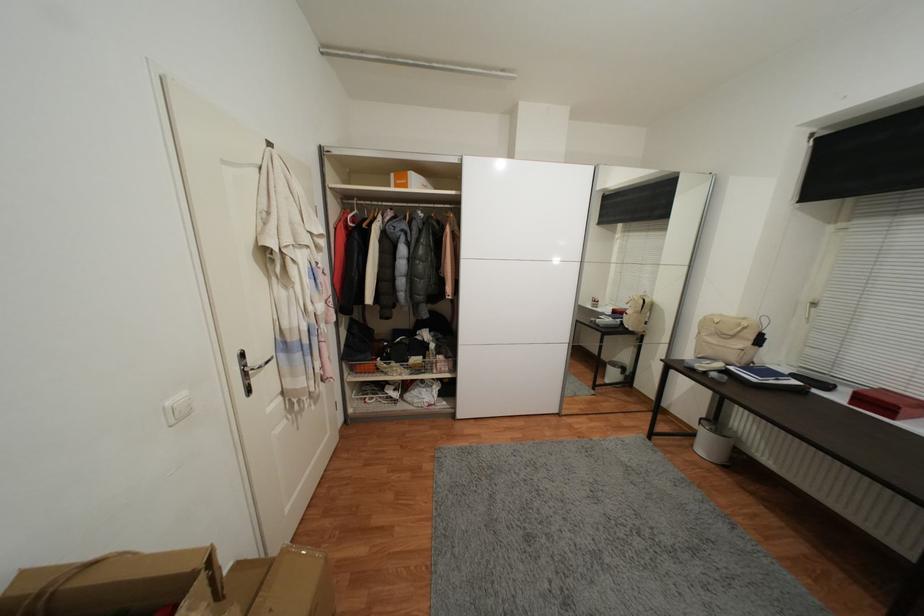
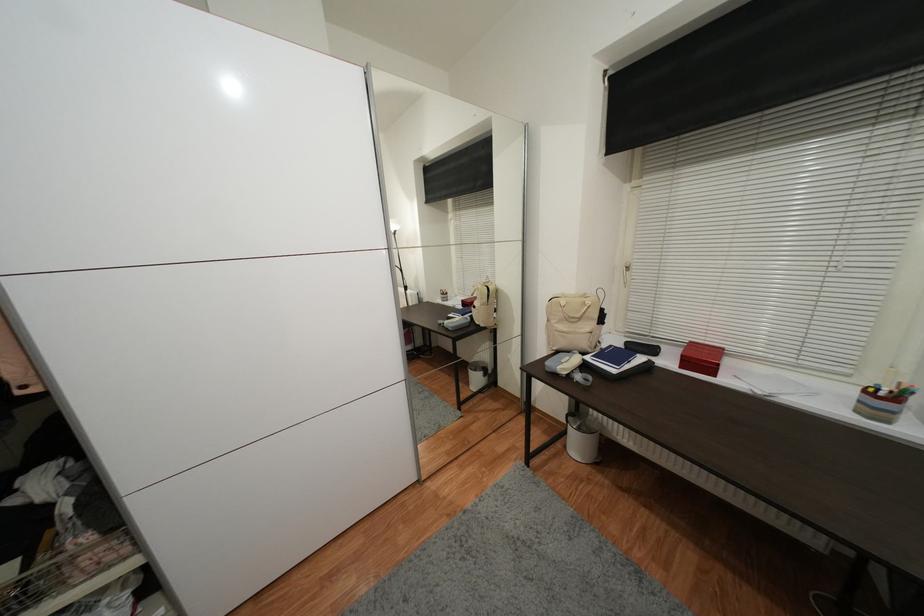
The point at (889, 405) is marked in the first image. Where is the corresponding point in the second image?

(706, 361)